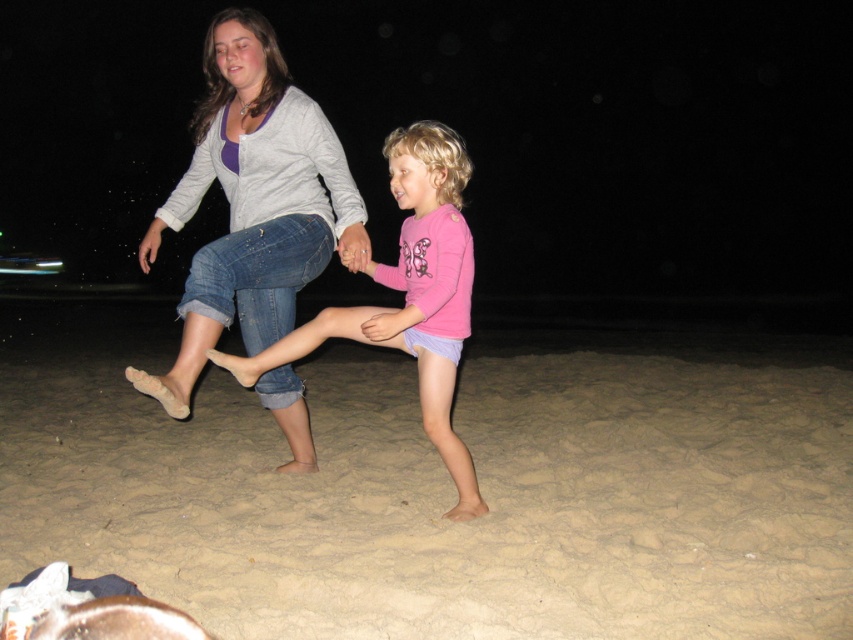
Question: Can you confirm if light brown sandy beach at lower center is positioned to the left of denim jeans at center?

Choices:
 (A) no
 (B) yes

Answer: (A)

Question: Which point appears farthest from the camera in this image?

Choices:
 (A) (300, 138)
 (B) (408, 147)

Answer: (A)

Question: In this image, where is light brown sandy beach at lower center located relative to denim jeans at center?

Choices:
 (A) above
 (B) below

Answer: (B)

Question: Which object appears closest to the camera in this image?

Choices:
 (A) light brown sandy beach at lower center
 (B) denim jeans at center

Answer: (B)

Question: Where is light brown sandy beach at lower center located in relation to pink matte shirt at center in the image?

Choices:
 (A) left
 (B) right

Answer: (B)

Question: Among these points, which one is nearest to the camera?

Choices:
 (A) (421, 384)
 (B) (172, 401)
 (C) (312, 628)

Answer: (C)